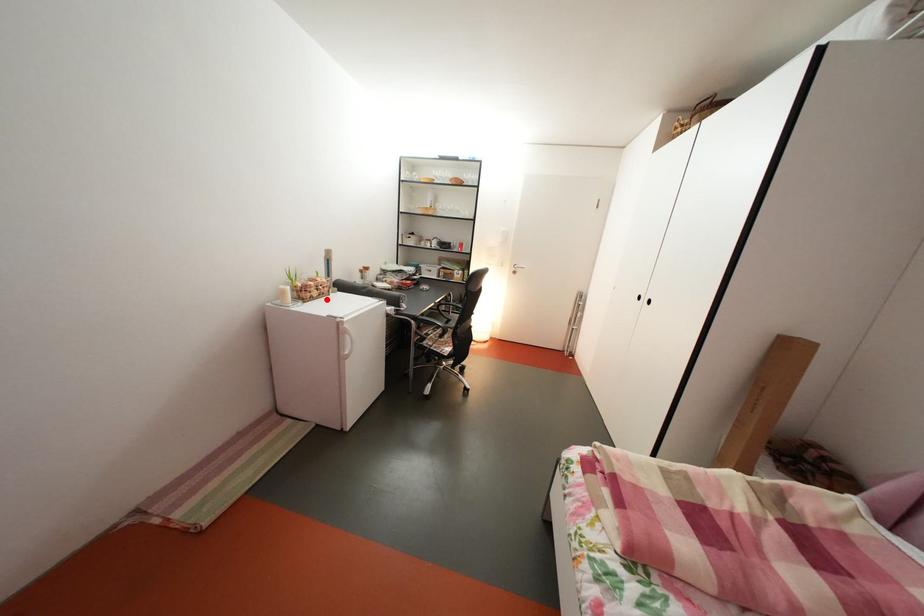
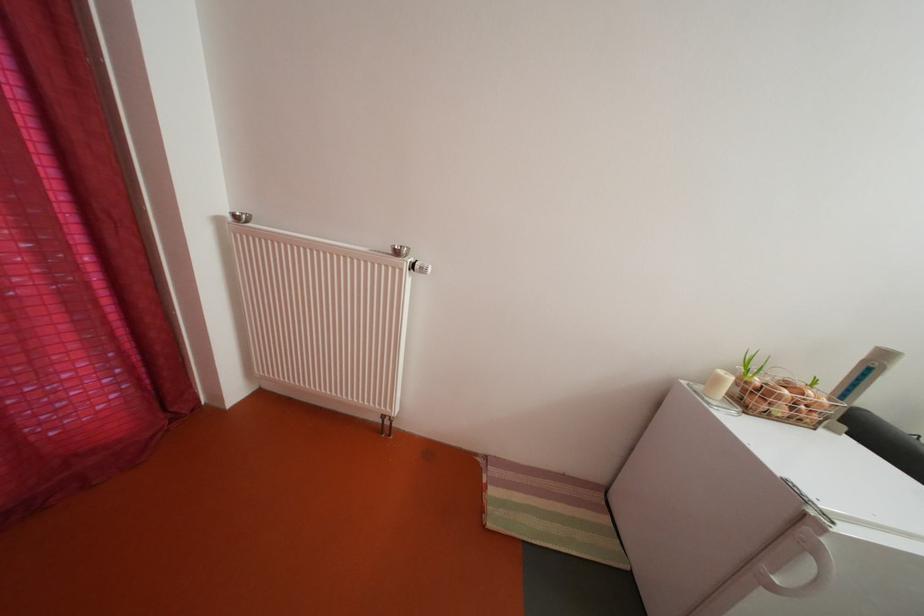
The point at the highlighted location is marked in the first image. Where is the corresponding point in the second image?

(792, 416)